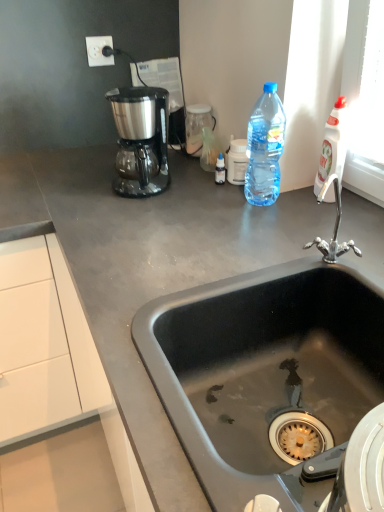
Question: Does white plastic electric outlet at upper left have a greater width compared to gray matte countertop at center?

Choices:
 (A) no
 (B) yes

Answer: (A)

Question: Can gray matte countertop at center be found inside white plastic electric outlet at upper left?

Choices:
 (A) yes
 (B) no

Answer: (B)

Question: Would you say white plastic electric outlet at upper left is a long distance from gray matte countertop at center?

Choices:
 (A) no
 (B) yes

Answer: (A)

Question: Does white plastic electric outlet at upper left lie in front of gray matte countertop at center?

Choices:
 (A) no
 (B) yes

Answer: (A)

Question: From the image's perspective, is white plastic electric outlet at upper left on gray matte countertop at center?

Choices:
 (A) yes
 (B) no

Answer: (A)

Question: From the image's perspective, is white plastic electric outlet at upper left positioned above or below white plastic bottle at upper right, the 1th bottle when ordered from right to left?

Choices:
 (A) below
 (B) above

Answer: (B)

Question: From a real-world perspective, is white plastic electric outlet at upper left above or below white plastic bottle at upper right, the 2th bottle from the left?

Choices:
 (A) below
 (B) above

Answer: (B)

Question: Considering the positions of white plastic electric outlet at upper left and white plastic bottle at upper right, the 2th bottle from the left, in the image, is white plastic electric outlet at upper left taller or shorter than white plastic bottle at upper right, the 2th bottle from the left,?

Choices:
 (A) tall
 (B) short

Answer: (B)

Question: Which is correct: white plastic electric outlet at upper left is inside white plastic bottle at upper right, the 2th bottle from the left, or outside of it?

Choices:
 (A) inside
 (B) outside

Answer: (B)

Question: Is black matte sink at center bigger or smaller than translucent plastic bottle at upper right, the 1th bottle in the left-to-right sequence?

Choices:
 (A) big
 (B) small

Answer: (A)

Question: Is black matte sink at center taller or shorter than translucent plastic bottle at upper right, the 2th bottle from the right?

Choices:
 (A) short
 (B) tall

Answer: (B)

Question: Is black matte sink at center situated inside translucent plastic bottle at upper right, the 2th bottle from the right, or outside?

Choices:
 (A) outside
 (B) inside

Answer: (A)

Question: Is black matte sink at center wider or thinner than translucent plastic bottle at upper right, the 2th bottle from the right?

Choices:
 (A) wide
 (B) thin

Answer: (A)

Question: Considering their positions, is satin black coffee maker at upper left located in front of or behind white plastic electric outlet at upper left?

Choices:
 (A) behind
 (B) front

Answer: (B)

Question: Looking at the image, does satin black coffee maker at upper left seem bigger or smaller compared to white plastic electric outlet at upper left?

Choices:
 (A) big
 (B) small

Answer: (A)